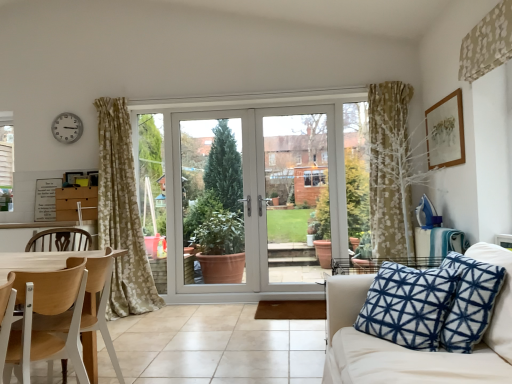
Question: Is clear glass door at center, arranged as the 2th screen door when viewed from the right, touching wooden chair at left?

Choices:
 (A) no
 (B) yes

Answer: (A)

Question: Is wooden chair at left at the back of clear glass door at center, acting as the first screen door starting from the left?

Choices:
 (A) no
 (B) yes

Answer: (A)

Question: Does clear glass door at center, acting as the first screen door starting from the left, have a greater height compared to wooden chair at left?

Choices:
 (A) no
 (B) yes

Answer: (B)

Question: Does clear glass door at center, arranged as the 2th screen door when viewed from the right, have a lesser width compared to wooden chair at left?

Choices:
 (A) yes
 (B) no

Answer: (A)

Question: From the image's perspective, is clear glass door at center, arranged as the 2th screen door when viewed from the right, located beneath wooden chair at left?

Choices:
 (A) yes
 (B) no

Answer: (B)

Question: Could you tell me if clear glass door at center, arranged as the 2th screen door when viewed from the right, is facing wooden chair at left?

Choices:
 (A) yes
 (B) no

Answer: (A)

Question: Does wooden picture frame at upper right have a larger size compared to wooden chair at left?

Choices:
 (A) no
 (B) yes

Answer: (A)

Question: Can you confirm if wooden picture frame at upper right is thinner than wooden chair at left?

Choices:
 (A) no
 (B) yes

Answer: (B)

Question: From the image's perspective, is wooden picture frame at upper right beneath wooden chair at left?

Choices:
 (A) yes
 (B) no

Answer: (B)

Question: From a real-world perspective, is wooden picture frame at upper right under wooden chair at left?

Choices:
 (A) no
 (B) yes

Answer: (A)

Question: Does wooden picture frame at upper right contain wooden chair at left?

Choices:
 (A) yes
 (B) no

Answer: (B)

Question: Is wooden picture frame at upper right beside wooden chair at left?

Choices:
 (A) no
 (B) yes

Answer: (A)

Question: Is clear glass door at center, acting as the first screen door starting from the right, wider than wooden chair at left?

Choices:
 (A) no
 (B) yes

Answer: (A)